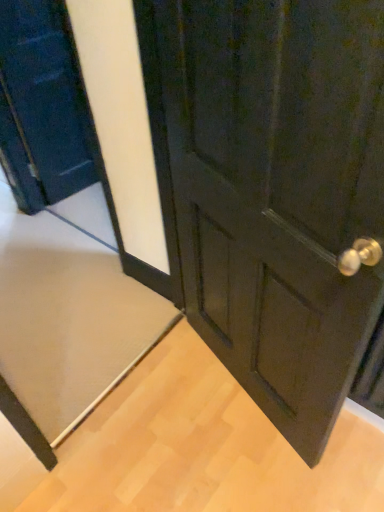
Question: In terms of width, does matte black door at center, the 2th door viewed from the left, look wider or thinner when compared to matte black door at left, which appears as the 2th door when viewed from the right?

Choices:
 (A) wide
 (B) thin

Answer: (A)

Question: Which is correct: matte black door at center, the 2th door viewed from the left, is inside matte black door at left, which appears as the 2th door when viewed from the right, or outside of it?

Choices:
 (A) inside
 (B) outside

Answer: (B)

Question: Which object is the farthest from the matte black door at left, placed as the first door when sorted from left to right?

Choices:
 (A) beige carpet at lower left
 (B) matte black door at center, positioned as the 1th door in right-to-left order

Answer: (B)

Question: Estimate the real-world distances between objects in this image. Which object is farther from the beige carpet at lower left?

Choices:
 (A) matte black door at center, the 2th door viewed from the left
 (B) matte black door at left, which appears as the 2th door when viewed from the right

Answer: (A)